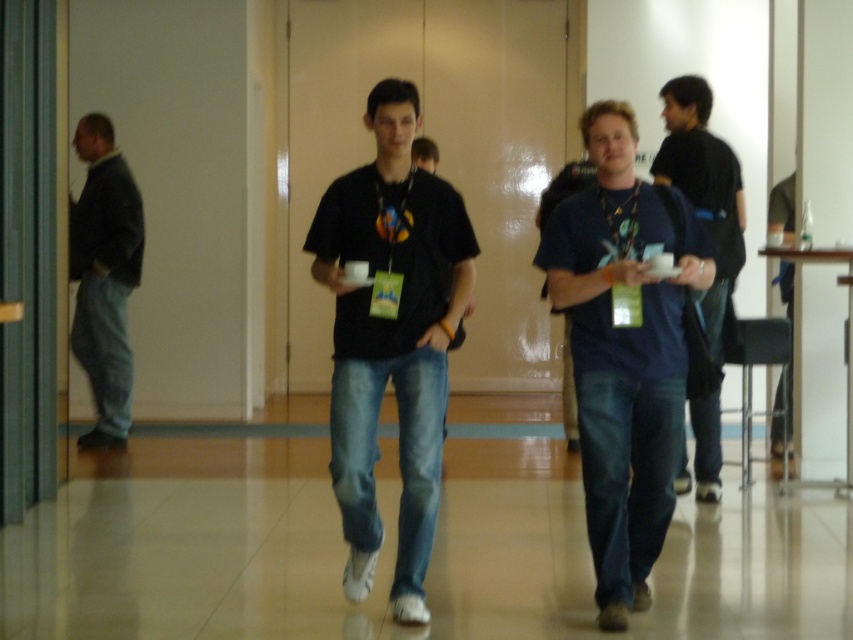
Who is more forward, (345, 412) or (602, 560)?

Point (602, 560) is in front.

Is point (413, 264) closer to viewer compared to point (608, 371)?

No.

Is point (358, 198) less distant than point (634, 320)?

No, (358, 198) is behind (634, 320).

Identify the location of black matte t-shirt at center. [x=392, y=337].

Between dark blue jeans at left and dark blue jeans at right, which one appears on the left side from the viewer's perspective?

dark blue jeans at left is more to the left.

Which is in front, point (109, 400) or point (788, 388)?

Point (788, 388) is more forward.

The image size is (853, 640). What do you see at coordinates (103, 276) in the screenshot?
I see `dark blue jeans at left` at bounding box center [103, 276].

This screenshot has width=853, height=640. Find the location of `dark blue jeans at left`. dark blue jeans at left is located at coordinates pyautogui.click(x=103, y=276).

Is dark blue jeans at center wider than dark blue jeans at right?

Yes, dark blue jeans at center is wider than dark blue jeans at right.

Can you confirm if dark blue jeans at center is bigger than dark blue jeans at right?

Yes, dark blue jeans at center is bigger than dark blue jeans at right.

This screenshot has height=640, width=853. In order to click on dark blue jeans at center in this screenshot , I will do 704,189.